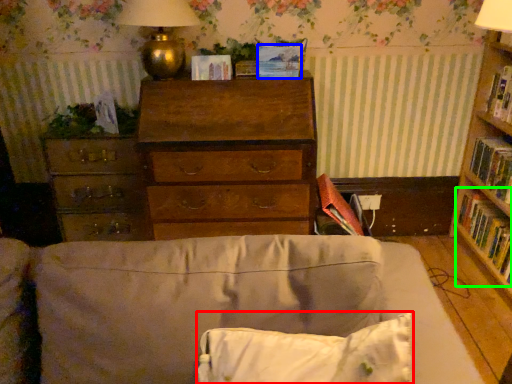
Question: Which is farther away from pillow (highlighted by a red box)? paperback book (highlighted by a blue box) or book (highlighted by a green box)?

Choices:
 (A) paperback book
 (B) book

Answer: (B)